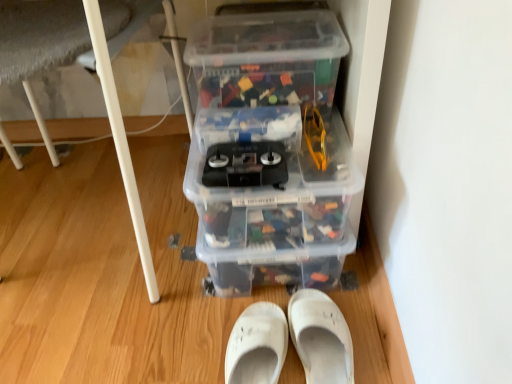
Question: Does transparent plastic storage box at upper center, positioned as the first storage box in top-to-bottom order, lie behind white plastic table leg at lower left?

Choices:
 (A) yes
 (B) no

Answer: (A)

Question: Is transparent plastic storage box at upper center, positioned as the first storage box in top-to-bottom order, at the left side of white plastic table leg at lower left?

Choices:
 (A) no
 (B) yes

Answer: (A)

Question: Considering the relative sizes of transparent plastic storage box at upper center, the 2th storage box from the bottom, and white plastic table leg at lower left in the image provided, is transparent plastic storage box at upper center, the 2th storage box from the bottom, bigger than white plastic table leg at lower left?

Choices:
 (A) yes
 (B) no

Answer: (B)

Question: Is transparent plastic storage box at upper center, the 2th storage box from the bottom, outside of white plastic table leg at lower left?

Choices:
 (A) yes
 (B) no

Answer: (A)

Question: Are transparent plastic storage box at upper center, the 2th storage box from the bottom, and white plastic table leg at lower left making contact?

Choices:
 (A) yes
 (B) no

Answer: (B)

Question: Is white matte shoe at lower center, positioned as the second footwear in right-to-left order, to the left or to the right of transparent plastic storage box at upper center, the 2th storage box from the bottom, in the image?

Choices:
 (A) right
 (B) left

Answer: (B)

Question: From the image's perspective, relative to transparent plastic storage box at upper center, the 2th storage box from the bottom, is white matte shoe at lower center, positioned as the second footwear in right-to-left order, above or below?

Choices:
 (A) above
 (B) below

Answer: (B)

Question: Considering the positions of white matte shoe at lower center, placed as the first footwear when sorted from left to right, and transparent plastic storage box at upper center, the 2th storage box from the bottom, in the image, is white matte shoe at lower center, placed as the first footwear when sorted from left to right, wider or thinner than transparent plastic storage box at upper center, the 2th storage box from the bottom,?

Choices:
 (A) thin
 (B) wide

Answer: (B)

Question: From their relative heights in the image, would you say white matte shoe at lower center, placed as the first footwear when sorted from left to right, is taller or shorter than transparent plastic storage box at upper center, the 2th storage box from the bottom?

Choices:
 (A) tall
 (B) short

Answer: (B)

Question: From a real-world perspective, is white matte shoe at lower center, placed as the first footwear when sorted from left to right, positioned above or below white plastic table leg at lower left?

Choices:
 (A) above
 (B) below

Answer: (B)

Question: From the image's perspective, is white matte shoe at lower center, positioned as the second footwear in right-to-left order, positioned above or below white plastic table leg at lower left?

Choices:
 (A) above
 (B) below

Answer: (B)

Question: Considering the relative positions of white matte shoe at lower center, placed as the first footwear when sorted from left to right, and white plastic table leg at lower left in the image provided, is white matte shoe at lower center, placed as the first footwear when sorted from left to right, to the left or to the right of white plastic table leg at lower left?

Choices:
 (A) left
 (B) right

Answer: (B)

Question: Is white matte shoe at lower center, positioned as the second footwear in right-to-left order, wider or thinner than white plastic table leg at lower left?

Choices:
 (A) wide
 (B) thin

Answer: (B)

Question: From the image's perspective, is white plastic table leg at lower left above or below transparent plastic storage box at center, placed as the 2th storage box when sorted from top to bottom?

Choices:
 (A) below
 (B) above

Answer: (B)

Question: Considering the positions of white plastic table leg at lower left and transparent plastic storage box at center, placed as the 2th storage box when sorted from top to bottom, in the image, is white plastic table leg at lower left taller or shorter than transparent plastic storage box at center, placed as the 2th storage box when sorted from top to bottom,?

Choices:
 (A) short
 (B) tall

Answer: (B)